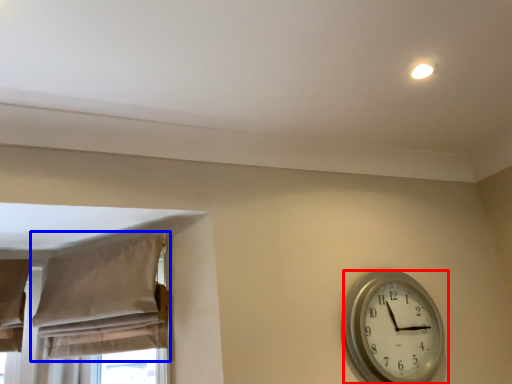
Question: Which of the following is the farthest to the observer, wall clock (highlighted by a red box) or curtain (highlighted by a blue box)?

Choices:
 (A) wall clock
 (B) curtain

Answer: (A)